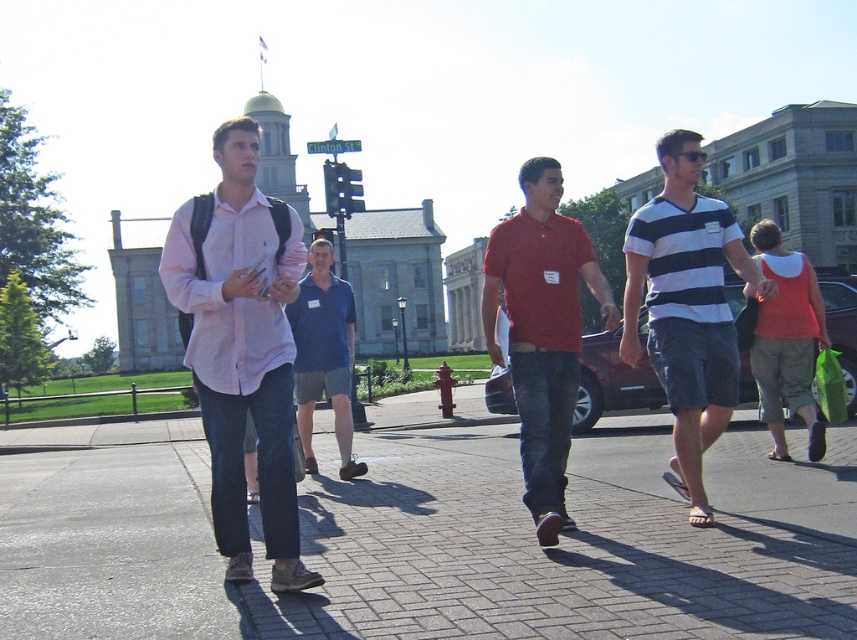
Question: Is striped cotton shirt at center positioned in front of matte orange tank top at right?

Choices:
 (A) no
 (B) yes

Answer: (B)

Question: Which of the following is the closest to the observer?

Choices:
 (A) blue cotton shirt at center
 (B) matte orange tank top at right

Answer: (B)

Question: Which point is closer to the camera?

Choices:
 (A) brick pavement at center
 (B) matte red polo shirt at center
 (C) pink cotton shirt at center

Answer: (A)

Question: Can you confirm if brick pavement at center is bigger than matte orange tank top at right?

Choices:
 (A) no
 (B) yes

Answer: (B)

Question: Can you confirm if pink cotton shirt at center is bigger than matte orange tank top at right?

Choices:
 (A) no
 (B) yes

Answer: (B)

Question: Which object is positioned farthest from the striped cotton shirt at center?

Choices:
 (A) matte orange tank top at right
 (B) brick pavement at center
 (C) blue cotton shirt at center

Answer: (B)